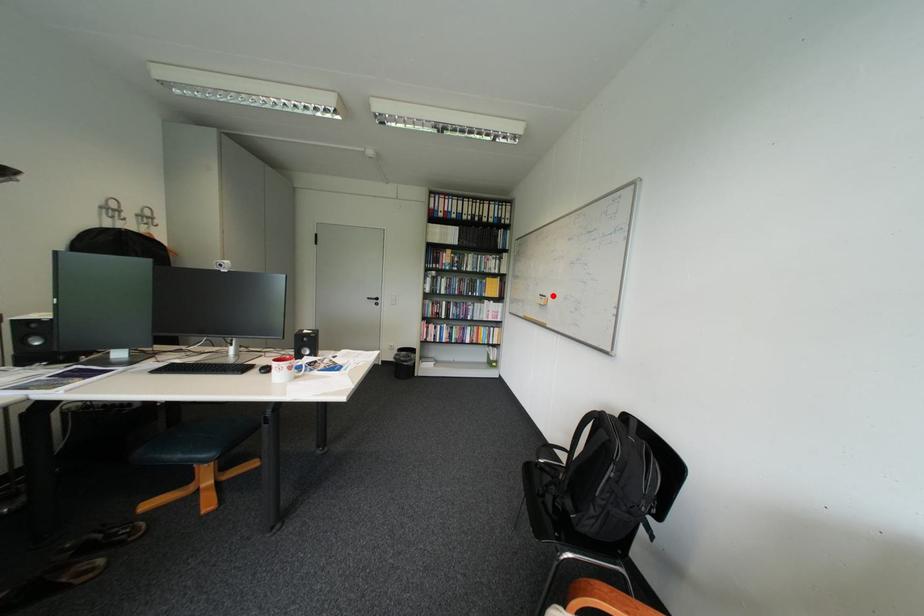
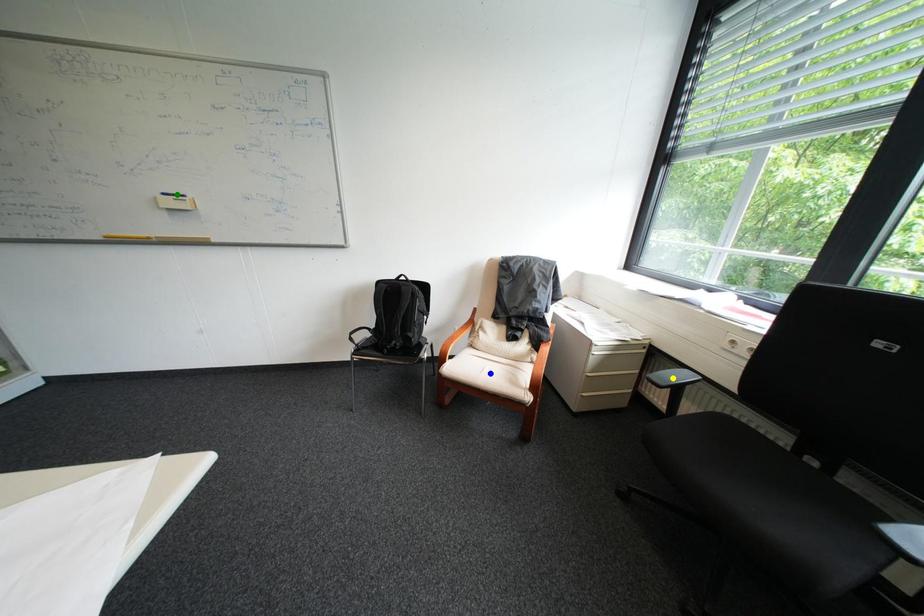
Question: I am providing you with two images of the same scene from different viewpoints. A red point is marked on the first image. You are given multiple points on the second image. Which point in image 2 represents the same 3d spot as the red point in image 1?

Choices:
 (A) green point
 (B) blue point
 (C) yellow point

Answer: (A)